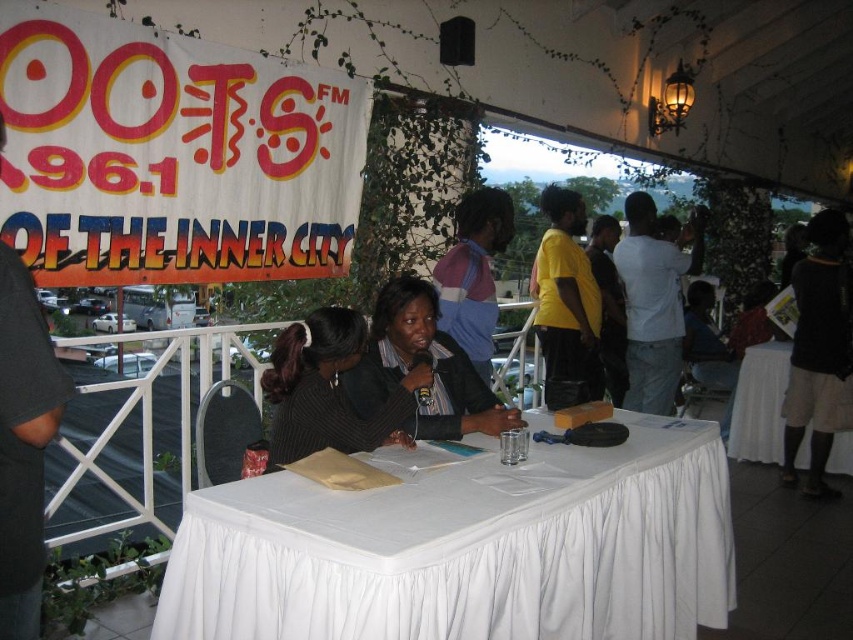
Question: Can you confirm if dark gray sweater at center is thinner than matte black jacket at center?

Choices:
 (A) no
 (B) yes

Answer: (B)

Question: Which point is farther from the camera taking this photo?

Choices:
 (A) (279, 387)
 (B) (734, 428)
 (C) (711, 614)

Answer: (B)

Question: Which point appears closest to the camera in this image?

Choices:
 (A) (540, 465)
 (B) (294, 348)
 (C) (428, 396)
 (D) (767, 380)

Answer: (A)

Question: Does matte black jacket at center appear over white cloth-covered table at right?

Choices:
 (A) no
 (B) yes

Answer: (B)

Question: Which of the following is the farthest from the observer?

Choices:
 (A) (270, 524)
 (B) (764, 420)

Answer: (B)

Question: Is white cloth-covered table at center below dark gray sweater at center?

Choices:
 (A) yes
 (B) no

Answer: (A)